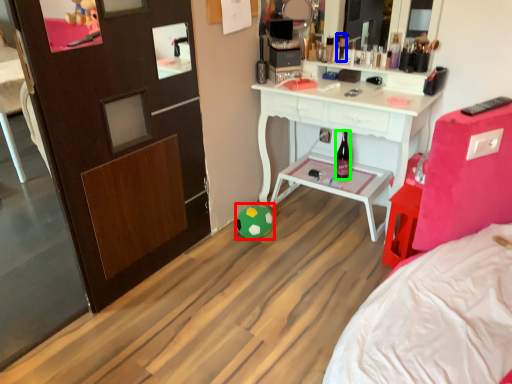
Question: Which object is positioned closest to toy (highlighted by a red box)? Select from toiletry (highlighted by a blue box) and bottle (highlighted by a green box).

Choices:
 (A) toiletry
 (B) bottle

Answer: (B)